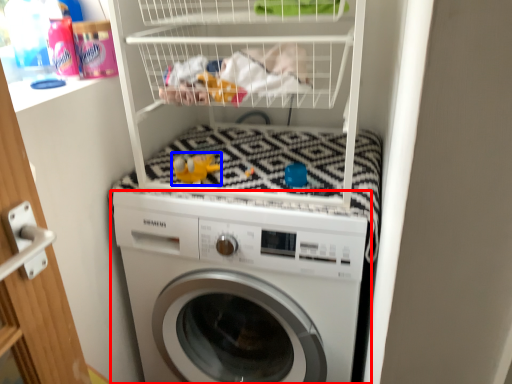
Question: Which object appears closest to the camera in this image, washing machine (highlighted by a red box) or toy (highlighted by a blue box)?

Choices:
 (A) washing machine
 (B) toy

Answer: (A)